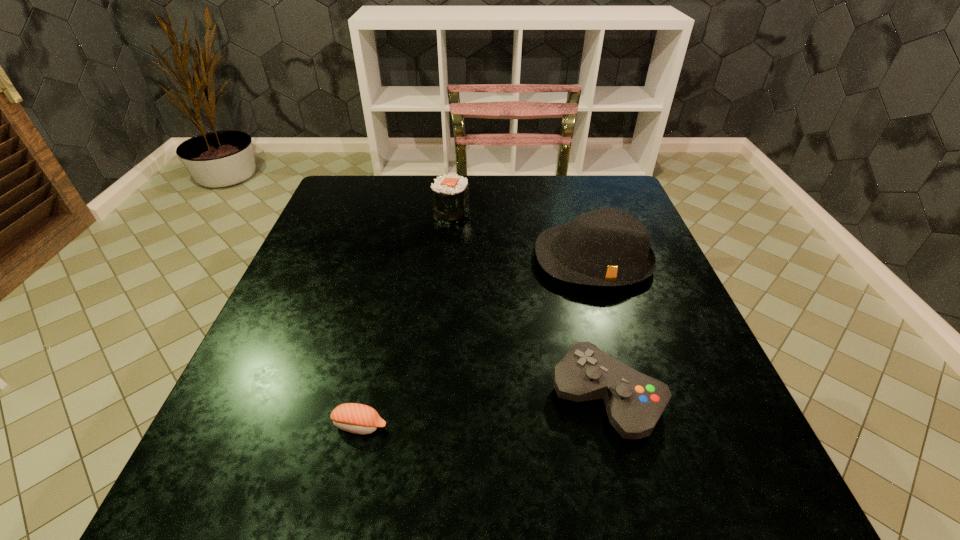
Find the location of `fedora`. fedora is located at coordinates (608, 247).

Locate an element on the screen. This screenshot has height=540, width=960. the second farthest object is located at coordinates (608, 247).

At what (x,y) coordinates should I click in order to perform the action: click on the third object from right to left. Please return your answer as a coordinate pair (x, y). Looking at the image, I should click on (450, 193).

Identify the location of the second tallest object. This screenshot has width=960, height=540. (x=450, y=193).

Image resolution: width=960 pixels, height=540 pixels. Find the location of `control`. control is located at coordinates (634, 402).

Where is `the shortest object`? the shortest object is located at coordinates (356, 418).

I want to click on the leftmost object, so click(356, 418).

This screenshot has height=540, width=960. Identify the location of vacant position located on the front-facing side of the tallest object. (642, 419).

This screenshot has width=960, height=540. I want to click on vacant region located on the front of the third shortest object, so click(443, 303).

At what (x,y) coordinates should I click in order to perform the action: click on free point located on the right of the third tallest object. Please return your answer as a coordinate pair (x, y). Looking at the image, I should click on (719, 398).